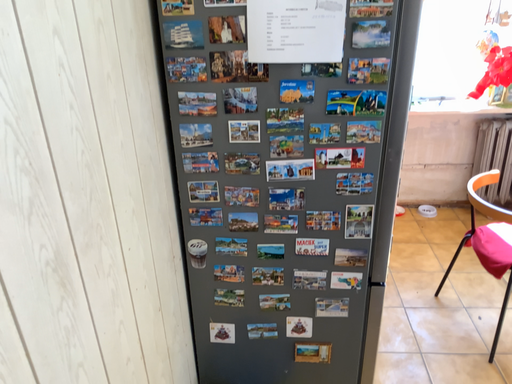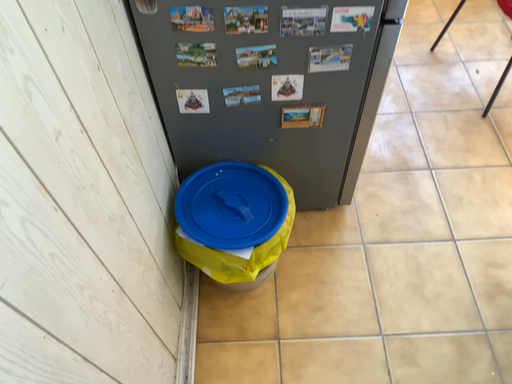
Question: Which way did the camera rotate in the video?

Choices:
 (A) rotated downward
 (B) rotated upward

Answer: (A)